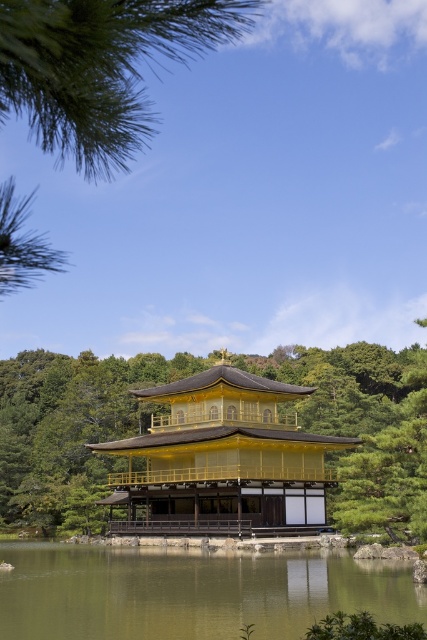
The width and height of the screenshot is (427, 640). In order to click on green liquid water at center in this screenshot , I will do `click(190, 593)`.

At what (x,y) coordinates should I click in order to perform the action: click on green liquid water at center. Please return your answer as a coordinate pair (x, y). Looking at the image, I should click on (190, 593).

Who is positioned more to the right, green liquid water at center or gold lacquered wood temple at center?

Positioned to the right is gold lacquered wood temple at center.

Is point (149, 630) closer to viewer compared to point (269, 429)?

Yes, it is in front of point (269, 429).

Does point (82, 564) lie in front of point (154, 499)?

Yes, point (82, 564) is closer to viewer.

Find the location of a particular element. green liquid water at center is located at coordinates [190, 593].

What do you see at coordinates (101, 67) in the screenshot? I see `green needle-like leaves at upper left` at bounding box center [101, 67].

Which of these two, green needle-like leaves at upper left or gold lacquered wood temple at center, stands taller?

Standing taller between the two is green needle-like leaves at upper left.

Is point (40, 100) in front of point (219, 381)?

Yes, it is in front of point (219, 381).

You are a GUI agent. You are given a task and a screenshot of the screen. Output one action in this format:
    pyautogui.click(x=<x>, y=<y>)
    Task: Click on the green needle-like leaves at upper left
    The width and height of the screenshot is (427, 640).
    Given the screenshot: What is the action you would take?
    pyautogui.click(x=101, y=67)